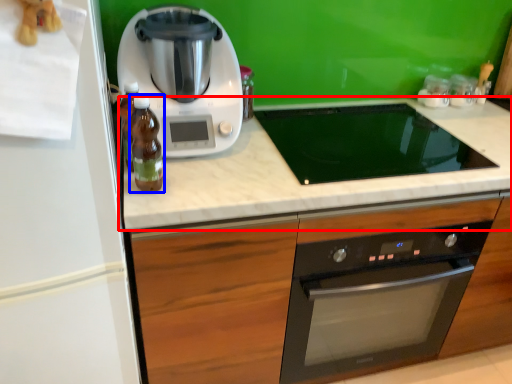
Question: Which of the following is the closest to the observer, countertop (highlighted by a red box) or bottle (highlighted by a blue box)?

Choices:
 (A) countertop
 (B) bottle

Answer: (B)